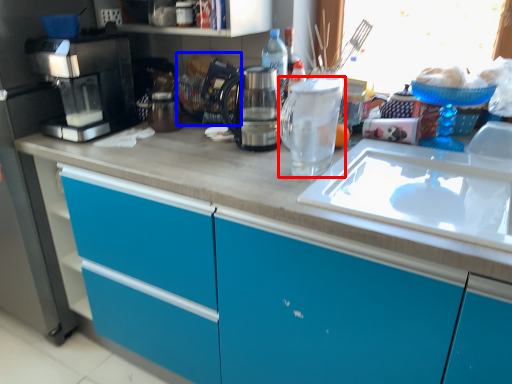
Question: Which point is further to the camera, kitchen appliance (highlighted by a red box) or appliance (highlighted by a blue box)?

Choices:
 (A) kitchen appliance
 (B) appliance

Answer: (B)